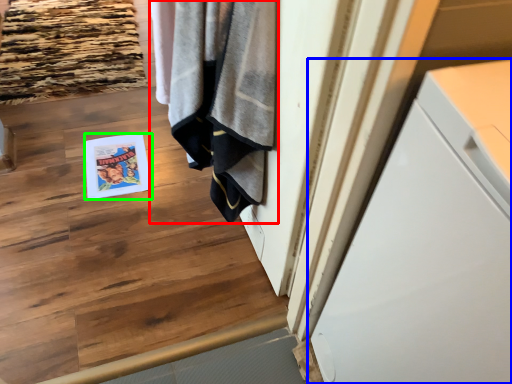
Question: Considering the real-world distances, which object is farthest from bath towel (highlighted by a red box)? cabinetry (highlighted by a blue box) or magazine (highlighted by a green box)?

Choices:
 (A) cabinetry
 (B) magazine

Answer: (B)